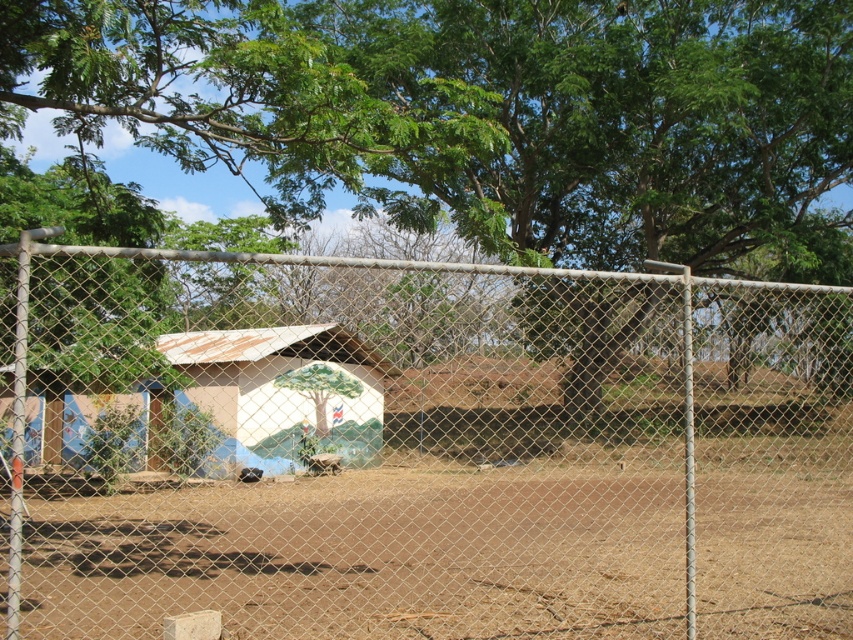
Consider the image. Who is more distant from viewer, [809,582] or [204,387]?

The point [204,387] is more distant.

Who is more forward, (596, 604) or (260, 440)?

Point (596, 604)

Does point (180, 609) lie behind point (184, 355)?

No, it is in front of (184, 355).

Find the location of a particular element. This screenshot has height=640, width=853. brown dirt field at center is located at coordinates (363, 554).

Can you confirm if metal mesh fence at center is positioned above green leafy tree at upper center?

No, metal mesh fence at center is not above green leafy tree at upper center.

Which is in front, point (341, 456) or point (422, 72)?

Point (341, 456) is in front.

Between point (671, 433) and point (584, 179), which one is positioned in front?

Point (584, 179) is more forward.

The image size is (853, 640). Identify the location of metal mesh fence at center. (418, 449).

Where is `green leafy tree at upper center`? The width and height of the screenshot is (853, 640). green leafy tree at upper center is located at coordinates (486, 115).

Can you confirm if green leafy tree at upper center is positioned to the left of beige painted hut at center?

Yes, green leafy tree at upper center is to the left of beige painted hut at center.

Locate an element on the screen. This screenshot has height=640, width=853. green leafy tree at upper center is located at coordinates (486, 115).